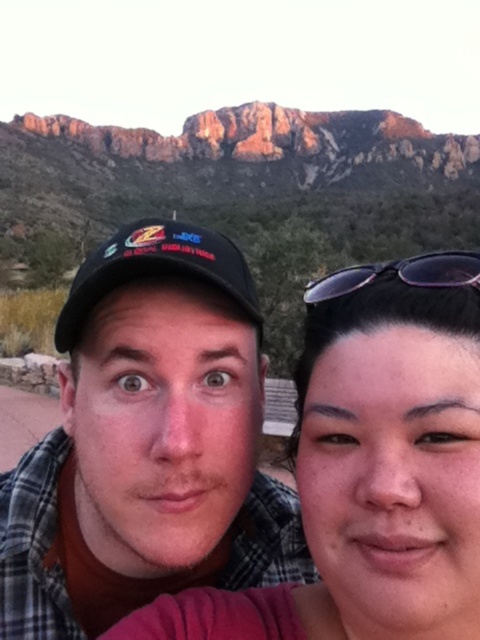
Does plaid shirt at center have a lesser width compared to purple plastic sunglasses at upper right?

No.

Which is above, plaid shirt at center or purple plastic sunglasses at upper right?

purple plastic sunglasses at upper right is above.

Is point (97, 392) farther from camera compared to point (336, 296)?

That is False.

At what (x,y) coordinates should I click in order to perform the action: click on plaid shirt at center. Please return your answer as a coordinate pair (x, y). Looking at the image, I should click on (147, 444).

Can you confirm if black matte baseball cap at center is positioned below purple plastic sunglasses at upper right?

Actually, black matte baseball cap at center is above purple plastic sunglasses at upper right.

Which of these two, black matte baseball cap at center or purple plastic sunglasses at upper right, stands taller?

black matte baseball cap at center

Who is more distant from viewer, (113, 269) or (415, 266)?

The point (113, 269) is more distant.

Identify the location of black matte baseball cap at center. (157, 269).

Is plaid shirt at center smaller than black matte baseball cap at center?

Indeed, plaid shirt at center has a smaller size compared to black matte baseball cap at center.

Between plaid shirt at center and black matte baseball cap at center, which one appears on the left side from the viewer's perspective?

Positioned to the left is black matte baseball cap at center.

What are the coordinates of `plaid shirt at center` in the screenshot? It's located at (147, 444).

Find the location of a particular element. This screenshot has height=640, width=480. plaid shirt at center is located at coordinates (147, 444).